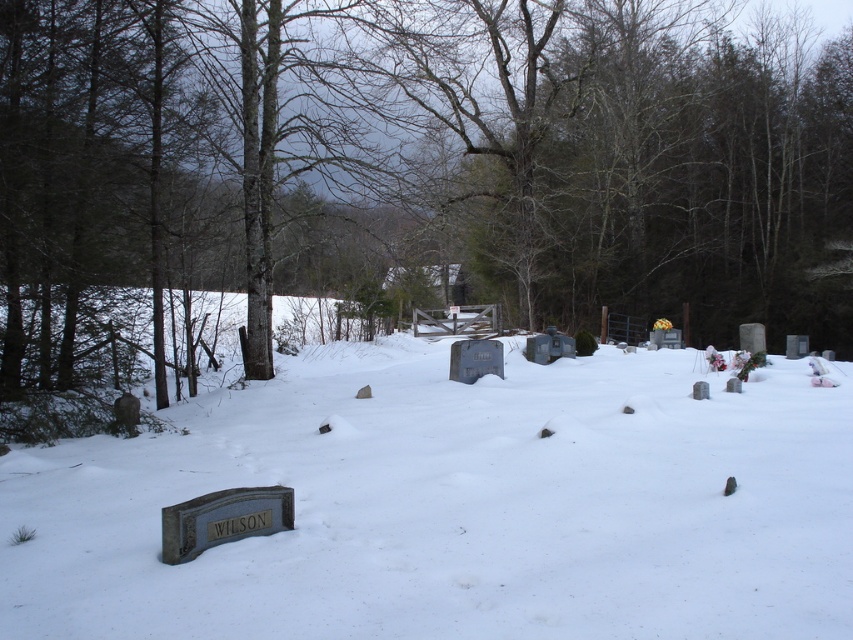
You are standing at the entrance of the cemetery and want to find the brown bark tree at center. According to the coordinates given, where should you look relative to the entrance?

The brown bark tree at center is located at coordinates point [407,177], which means it is positioned slightly to the left and forward from the entrance.

Consider the image. You are standing at the edge of a snowy cemetery and see the brown bark tree at center and the white matte snow at lower left. Which object is higher in position compared to the other?

The brown bark tree at center is above the white matte snow at lower left, so the brown bark tree at center is higher in position.

You are standing in the winter cemetery scene. There is a point marked at coordinate (407, 177). What object is located at this coordinate?

The point at coordinate (407, 177) indicates the location of the brown bark tree at center.